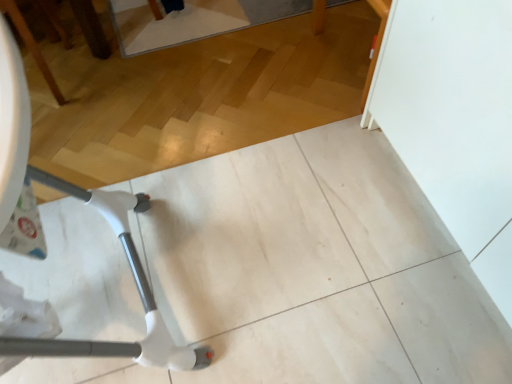
Locate an element on the screen. Image resolution: width=512 pixels, height=384 pixels. vacant space in front of wooden table at upper left is located at coordinates click(66, 133).